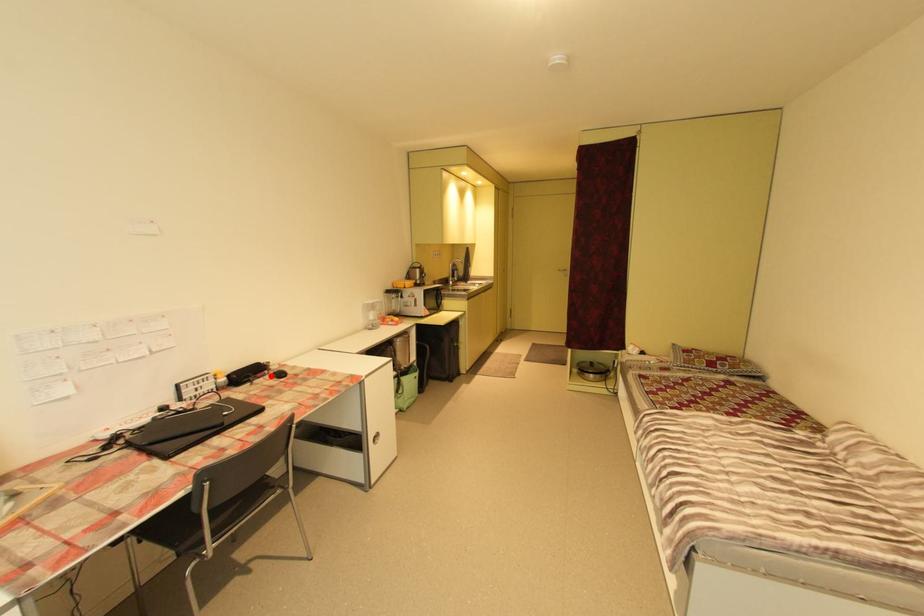
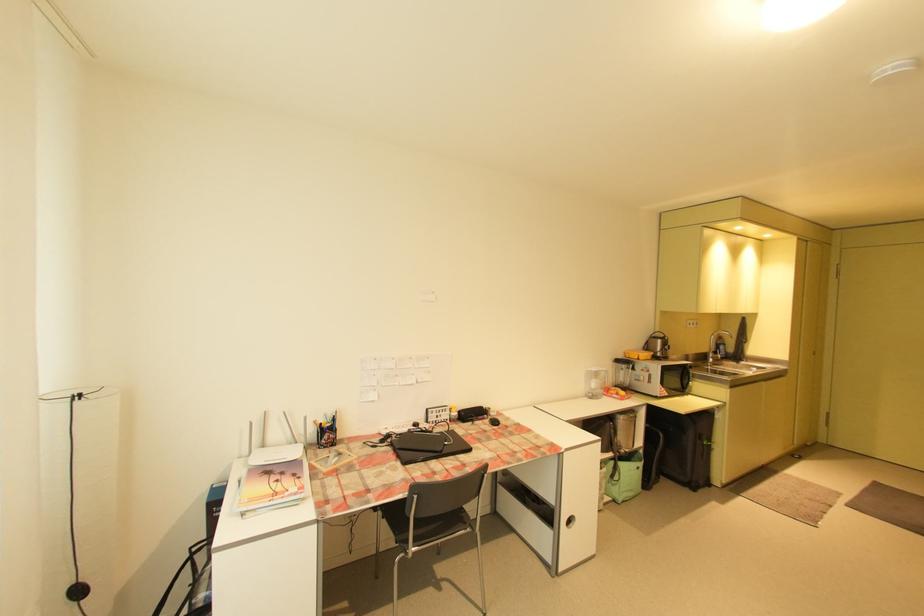
In the second image, find the point that corresponds to the highlighted location in the first image.

(491, 419)